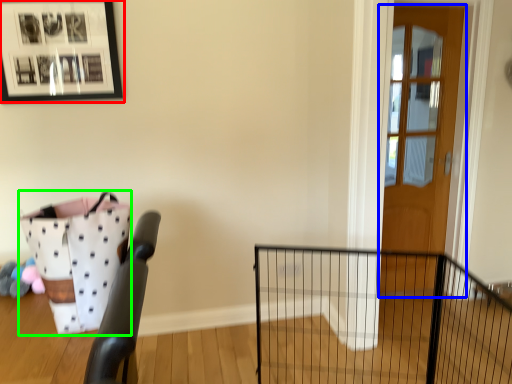
Question: Which object is the closest to the picture frame (highlighted by a red box)? Choose among these: door (highlighted by a blue box) or basket (highlighted by a green box).

Choices:
 (A) door
 (B) basket

Answer: (B)